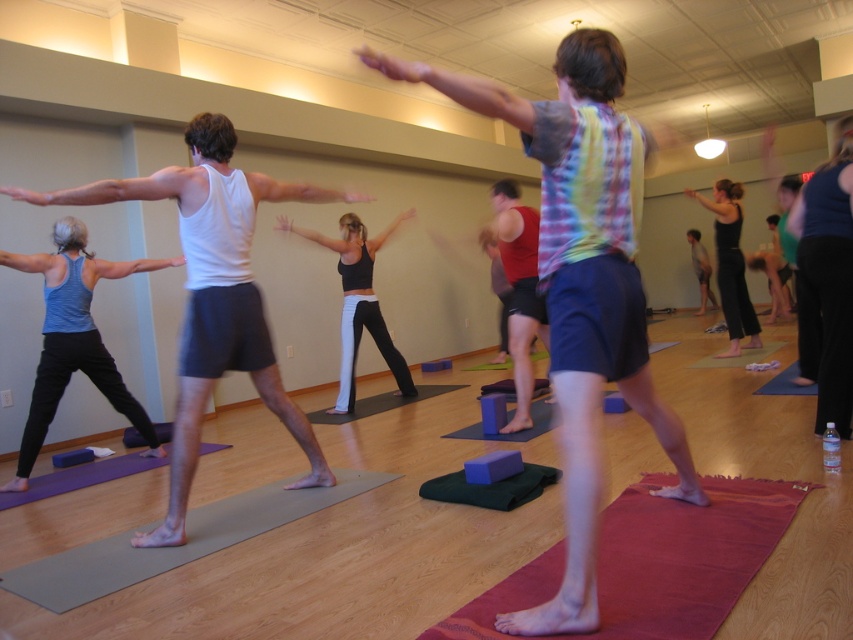
You are a photographer standing at the front of the yoga studio. You want to take a photo that includes both the point at (440, 625) and the point at (523, 340). Which point is closer to your camera?

Point at (440, 625) is closer to the camera than point at (523, 340).

You are a photographer positioned at the entrance of the studio. You want to take a photo that includes both the plaid fabric shirt at center and the black matte leggings at center. Given that your camera has a maximum focus range of 3 meters, will you be able to capture both subjects in focus?

The plaid fabric shirt at center and the black matte leggings at center are 3.14 meters apart from each other. Since the distance between them exceeds the camera focus range of 3 meters, the photographer cannot capture both subjects in focus simultaneously.